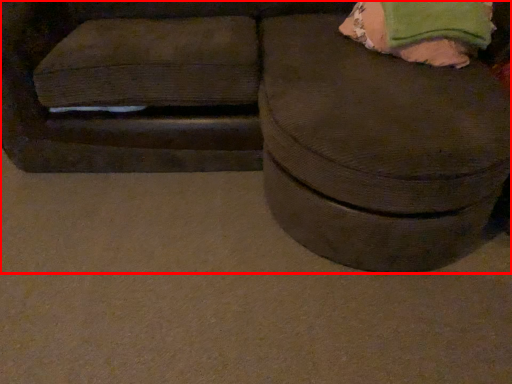
Question: In this image, where is furniture (annotated by the red box) located relative to bean bag chair?

Choices:
 (A) right
 (B) left

Answer: (B)